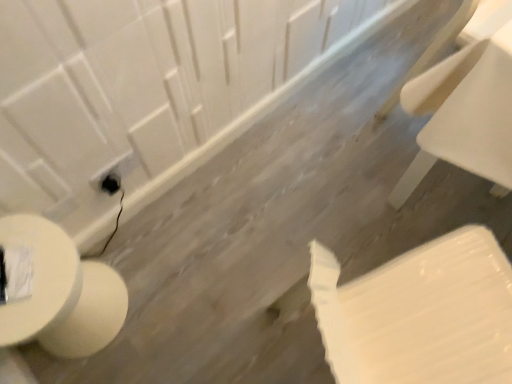
Find the location of a particular element. Image resolution: width=512 pixels, height=384 pixels. black plastic electric outlet at lower left is located at coordinates [x=111, y=183].

Identify the location of white plastic chair at upper right. This screenshot has width=512, height=384. (465, 115).

You are a GUI agent. You are given a task and a screenshot of the screen. Output one action in this format:
    pyautogui.click(x=<x>, y=<y>)
    Task: Click on the white glossy toilet paper at lower right
    
    Given the screenshot: What is the action you would take?
    pyautogui.click(x=419, y=313)

Which object is further away from the camera, white glossy toilet at lower left or white glossy toilet paper at lower right?

white glossy toilet at lower left.

Which of these two, white glossy toilet at lower left or white glossy toilet paper at lower right, stands taller?

With more height is white glossy toilet paper at lower right.

Based on the photo, which is closer to the camera, (120, 323) or (400, 350)?

Point (120, 323).

How much distance is there between white glossy toilet at lower left and white glossy toilet paper at lower right?

The distance of white glossy toilet at lower left from white glossy toilet paper at lower right is 29.14 inches.

This screenshot has width=512, height=384. In the image, there is a white plastic chair at upper right. In order to click on toilet below it (from a real-world perspective) in this screenshot , I will do `click(61, 293)`.

Between point (67, 258) and point (511, 103), which one is positioned behind?

The point (67, 258) is farther.

Based on their positions, is white glossy toilet at lower left located to the left or right of white plastic chair at upper right?

white glossy toilet at lower left is to the left of white plastic chair at upper right.

Is white plastic chair at upper right positioned in front of white glossy toilet at lower left?

No.

Is the surface of white plastic chair at upper right in direct contact with white glossy toilet at lower left?

white plastic chair at upper right is not next to white glossy toilet at lower left, and they're not touching.

Locate an element on the screen. chair that appears above the white glossy toilet at lower left (from a real-world perspective) is located at coordinates (465, 115).

From the image's perspective, which one is positioned higher, white plastic chair at upper right or white glossy toilet at lower left?

white plastic chair at upper right, from the image's perspective.

Is white plastic chair at upper right surrounded by white glossy toilet paper at lower right?

No, white plastic chair at upper right is not inside white glossy toilet paper at lower right.

Is white glossy toilet paper at lower right oriented towards white plastic chair at upper right?

No, white glossy toilet paper at lower right is not turned towards white plastic chair at upper right.

Looking at this image, which of these two, white glossy toilet paper at lower right or white plastic chair at upper right, is thinner?

white plastic chair at upper right is thinner.

From a real-world perspective, which object rests below the other?

black plastic electric outlet at lower left is physically lower.

Does white glossy toilet paper at lower right have a lesser width compared to black plastic electric outlet at lower left?

No.

Does white glossy toilet paper at lower right have a larger size compared to black plastic electric outlet at lower left?

Indeed, white glossy toilet paper at lower right has a larger size compared to black plastic electric outlet at lower left.

Considering the relative sizes of black plastic electric outlet at lower left and white glossy toilet paper at lower right in the image provided, is black plastic electric outlet at lower left wider than white glossy toilet paper at lower right?

In fact, black plastic electric outlet at lower left might be narrower than white glossy toilet paper at lower right.

Considering the positions of points (100, 184) and (440, 301), is point (100, 184) farther from camera compared to point (440, 301)?

That is True.

Is black plastic electric outlet at lower left touching white glossy toilet paper at lower right?

No, black plastic electric outlet at lower left is not with white glossy toilet paper at lower right.

From a real-world perspective, is black plastic electric outlet at lower left physically below white glossy toilet paper at lower right?

Correct, in the physical world, black plastic electric outlet at lower left is lower than white glossy toilet paper at lower right.

Is white plastic chair at upper right located within black plastic electric outlet at lower left?

Actually, white plastic chair at upper right is outside black plastic electric outlet at lower left.

From the image's perspective, between black plastic electric outlet at lower left and white plastic chair at upper right, who is located below?

From the image's view, black plastic electric outlet at lower left is below.

How different are the orientations of black plastic electric outlet at lower left and white plastic chair at upper right in degrees?

black plastic electric outlet at lower left and white plastic chair at upper right are facing 4.19 degrees away from each other.

Image resolution: width=512 pixels, height=384 pixels. What are the coordinates of `chair to the right of black plastic electric outlet at lower left` in the screenshot? It's located at (465, 115).

In order to click on toilet above the white glossy toilet paper at lower right (from the image's perspective) in this screenshot , I will do `click(61, 293)`.

This screenshot has width=512, height=384. I want to click on toilet in front of the white plastic chair at upper right, so click(61, 293).

Which object lies nearer to the anchor point white glossy toilet at lower left, white plastic chair at upper right or black plastic electric outlet at lower left?

black plastic electric outlet at lower left lies closer to white glossy toilet at lower left than the other object.

In the scene shown: When comparing their distances from black plastic electric outlet at lower left, does white glossy toilet paper at lower right or white plastic chair at upper right seem closer?

white glossy toilet paper at lower right is positioned closer to the anchor black plastic electric outlet at lower left.

When comparing their distances from white glossy toilet at lower left, does black plastic electric outlet at lower left or white plastic chair at upper right seem further?

Based on the image, white plastic chair at upper right appears to be further to white glossy toilet at lower left.

Which object lies nearer to the anchor point white glossy toilet paper at lower right, black plastic electric outlet at lower left or white glossy toilet at lower left?

The object closer to white glossy toilet paper at lower right is white glossy toilet at lower left.

Estimate the real-world distances between objects in this image. Which object is closer to black plastic electric outlet at lower left, white glossy toilet at lower left or white plastic chair at upper right?

Based on the image, white glossy toilet at lower left appears to be nearer to black plastic electric outlet at lower left.

Which object lies further to the anchor point white plastic chair at upper right, black plastic electric outlet at lower left or white glossy toilet at lower left?

Based on the image, white glossy toilet at lower left appears to be further to white plastic chair at upper right.

Looking at this image, estimate the real-world distances between objects in this image. Which object is closer to white glossy toilet paper at lower right, white plastic chair at upper right or white glossy toilet at lower left?

white plastic chair at upper right lies closer to white glossy toilet paper at lower right than the other object.

From the image, which object appears to be nearer to white glossy toilet at lower left, white plastic chair at upper right or white glossy toilet paper at lower right?

white glossy toilet paper at lower right is positioned closer to the anchor white glossy toilet at lower left.

The width and height of the screenshot is (512, 384). Identify the location of electric outlet between white glossy toilet at lower left and white plastic chair at upper right in the horizontal direction. (111, 183).

I want to click on electric outlet situated between white glossy toilet at lower left and white glossy toilet paper at lower right from left to right, so click(x=111, y=183).

Identify the location of toilet paper between black plastic electric outlet at lower left and white plastic chair at upper right from left to right. (419, 313).

Find the location of `toilet paper between white glossy toilet at lower left and white plastic chair at upper right in the horizontal direction`. toilet paper between white glossy toilet at lower left and white plastic chair at upper right in the horizontal direction is located at coordinates (419, 313).